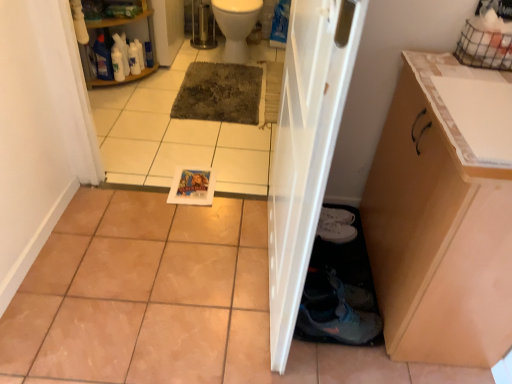
What are the coordinates of `vacant region to the right of white plastic shelf at upper left` in the screenshot? It's located at (169, 78).